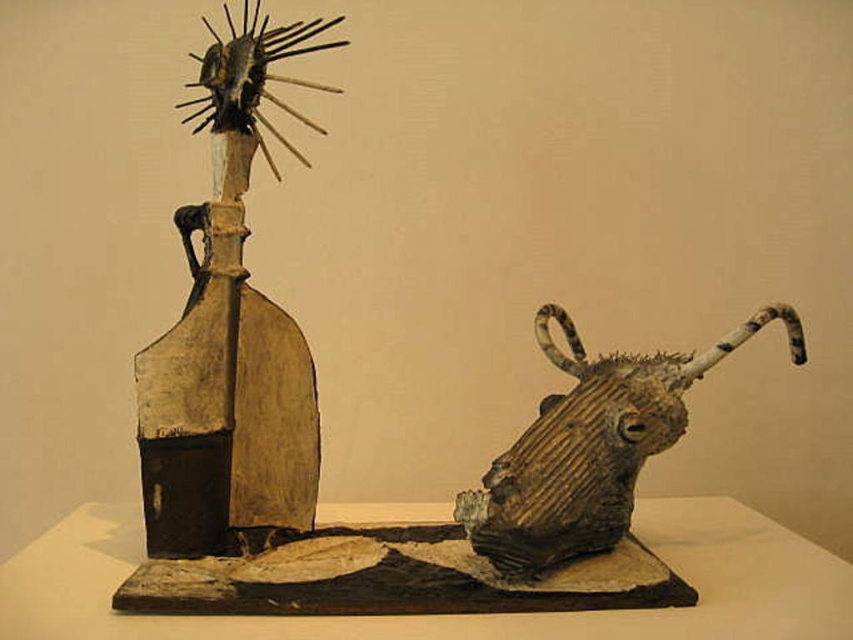
Is wooden bottle at left to the right of rustic wood bull head at right from the viewer's perspective?

No, wooden bottle at left is not to the right of rustic wood bull head at right.

Does wooden bottle at left have a smaller size compared to rustic wood bull head at right?

Indeed, wooden bottle at left has a smaller size compared to rustic wood bull head at right.

Who is more distant from viewer, (167, 422) or (631, 374)?

The point (631, 374) is behind.

The image size is (853, 640). What are the coordinates of `wooden bottle at left` in the screenshot? It's located at (229, 339).